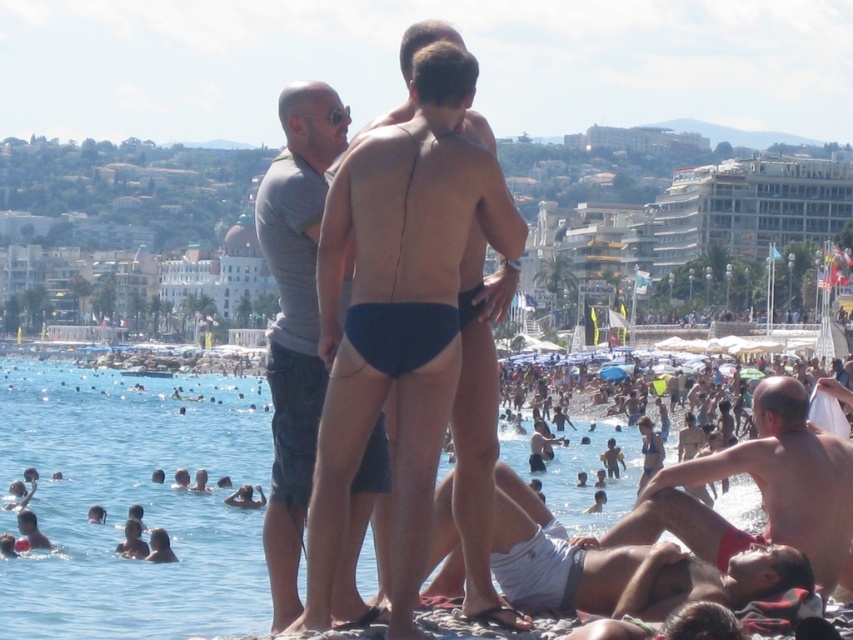
Question: Which object is closer to the camera taking this photo?

Choices:
 (A) matte red shorts at lower right
 (B) white cotton shorts at lower right
 (C) gray t-shirt at center

Answer: (B)

Question: Considering the relative positions of clear blue water at lower left and matte black swim trunks at center in the image provided, where is clear blue water at lower left located with respect to matte black swim trunks at center?

Choices:
 (A) right
 (B) left

Answer: (B)

Question: Among these objects, which one is farthest from the camera?

Choices:
 (A) matte black swim trunks at center
 (B) matte red shorts at lower right
 (C) clear blue water at lower left

Answer: (B)

Question: Which is farther from the white cotton shorts at lower right?

Choices:
 (A) matte red shorts at lower right
 (B) clear blue water at lower left
 (C) gray t-shirt at center
 (D) matte black swim trunks at center

Answer: (B)

Question: Is matte red shorts at lower right wider than white cotton shorts at lower right?

Choices:
 (A) no
 (B) yes

Answer: (B)

Question: Can you confirm if matte red shorts at lower right is smaller than white cotton shorts at lower right?

Choices:
 (A) yes
 (B) no

Answer: (B)